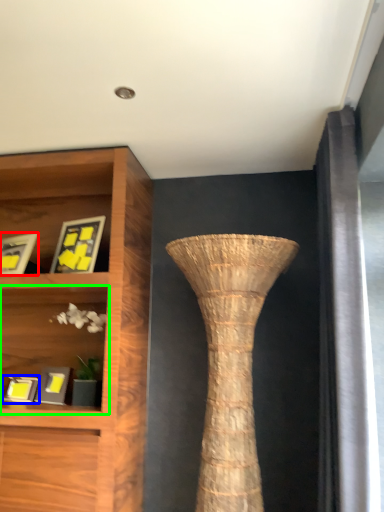
Question: Estimate the real-world distances between objects in this image. Which object is farther from picture frame (highlighted by a red box), picture frame (highlighted by a blue box) or shelf (highlighted by a green box)?

Choices:
 (A) picture frame
 (B) shelf

Answer: (A)